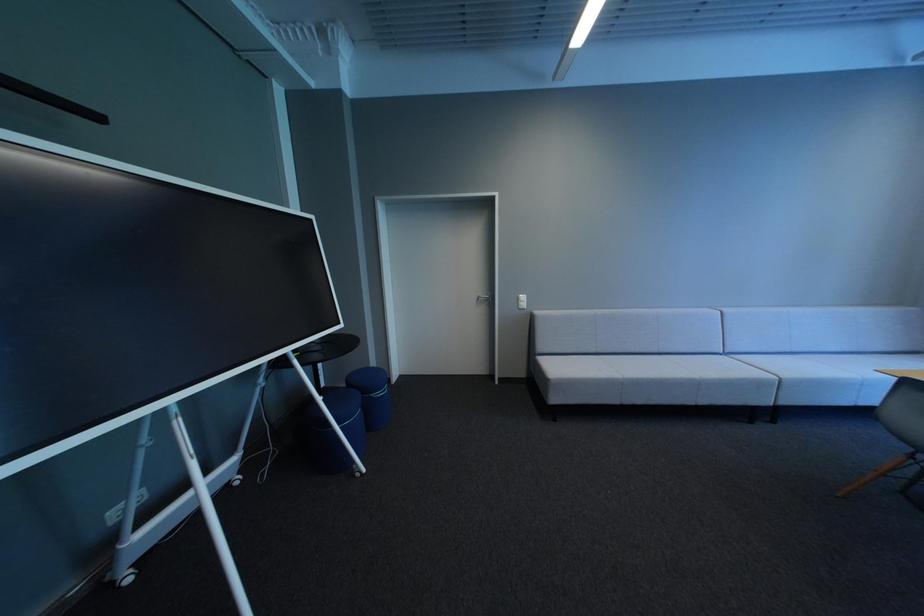
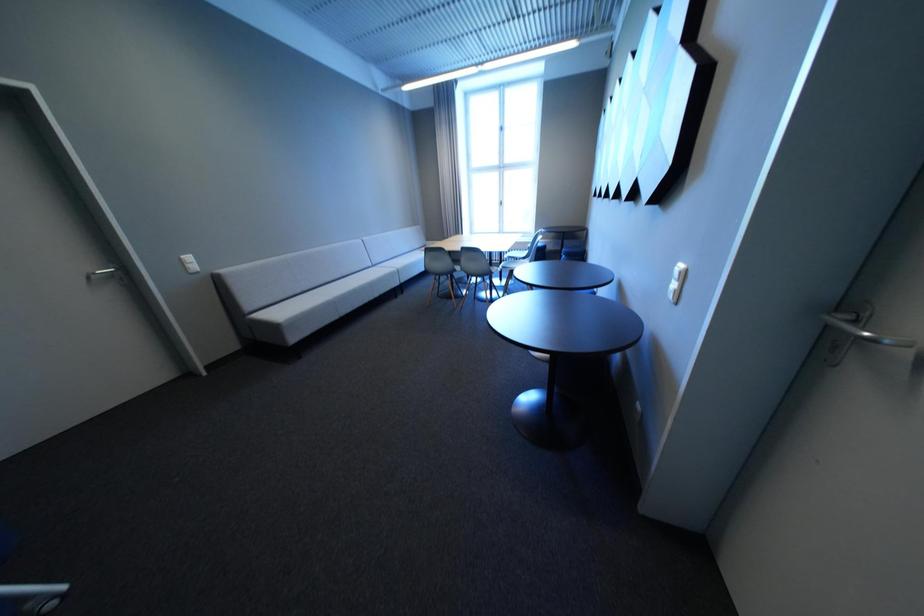
The images are taken continuously from a first-person perspective. In which direction is your viewpoint rotating?

The camera rotated toward right-down.